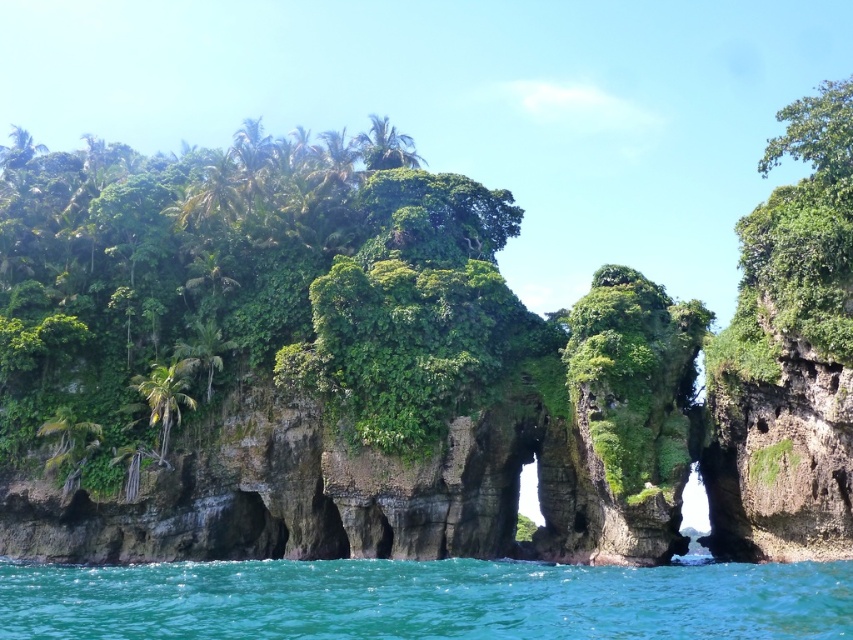
You are a photographer planning to capture the entire scene in one shot. Given that the turquoise liquid at lower center and the green leafy palm tree at left must both be visible, which object should you ensure has more space in your composition?

The turquoise liquid at lower center should have more space in the composition because it is larger in size than the green leafy palm tree at left.

You are standing on the rocky island and want to pour the turquoise liquid at lower center onto the roots of the green leafy palm tree at left. Is the liquid already positioned in a way that allows it to naturally flow towards the tree?

The turquoise liquid at lower center is below the green leafy palm tree at left, so pouring it would allow the liquid to naturally flow upwards, which is not possible. You would need to manually pour it upwards against gravity.